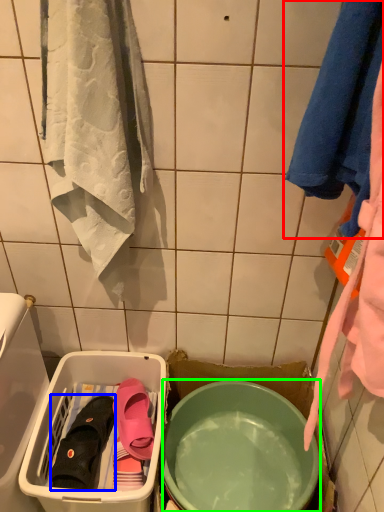
Question: Which object is positioned farthest from towel (highlighted by a red box)? Select from footwear (highlighted by a blue box) and mixing bowl (highlighted by a green box).

Choices:
 (A) footwear
 (B) mixing bowl

Answer: (A)